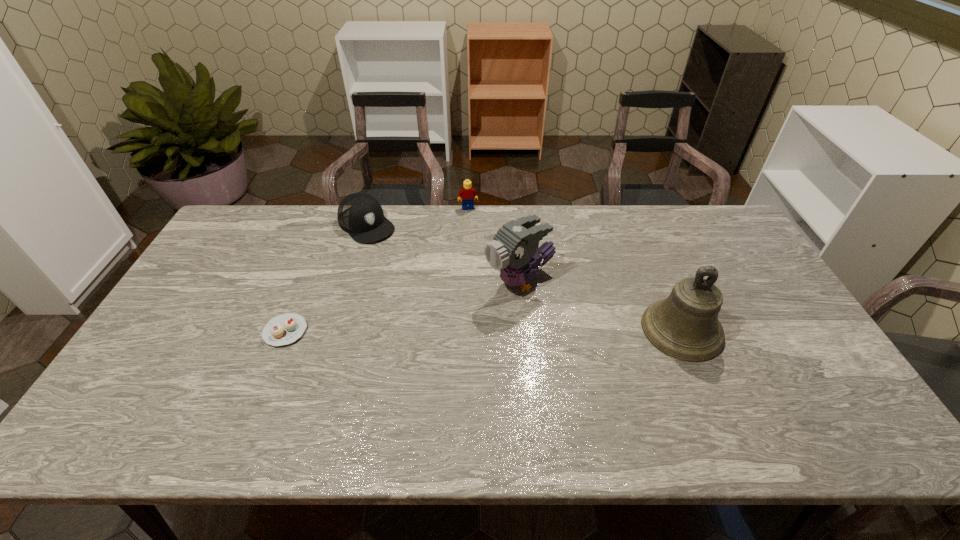
Locate an element on the screen. The width and height of the screenshot is (960, 540). vacant area at the right edge is located at coordinates (757, 267).

This screenshot has height=540, width=960. In order to click on free location at the far left corner of the desktop in this screenshot , I will do click(x=247, y=218).

Where is `vacant space in between the cap and the Lego`? The width and height of the screenshot is (960, 540). vacant space in between the cap and the Lego is located at coordinates (418, 217).

Identify the location of vacant area that lies between the third object from right to left and the cap. (418, 217).

Identify the location of free point between the second object from right to left and the rightmost object. (601, 306).

What are the coordinates of `free point between the cap and the cupcake` in the screenshot? It's located at tap(326, 278).

At what (x,y) coordinates should I click in order to perform the action: click on empty space that is in between the fourth object from left to right and the rightmost object. Please return your answer as a coordinate pair (x, y). The height and width of the screenshot is (540, 960). Looking at the image, I should click on point(601,306).

Locate an element on the screen. empty space between the Lego and the shortest object is located at coordinates (377, 269).

Where is `vacant area between the cap and the Lego`? vacant area between the cap and the Lego is located at coordinates (418, 217).

Image resolution: width=960 pixels, height=540 pixels. Find the location of `free point between the fourth object from left to right and the cap`. free point between the fourth object from left to right and the cap is located at coordinates (444, 254).